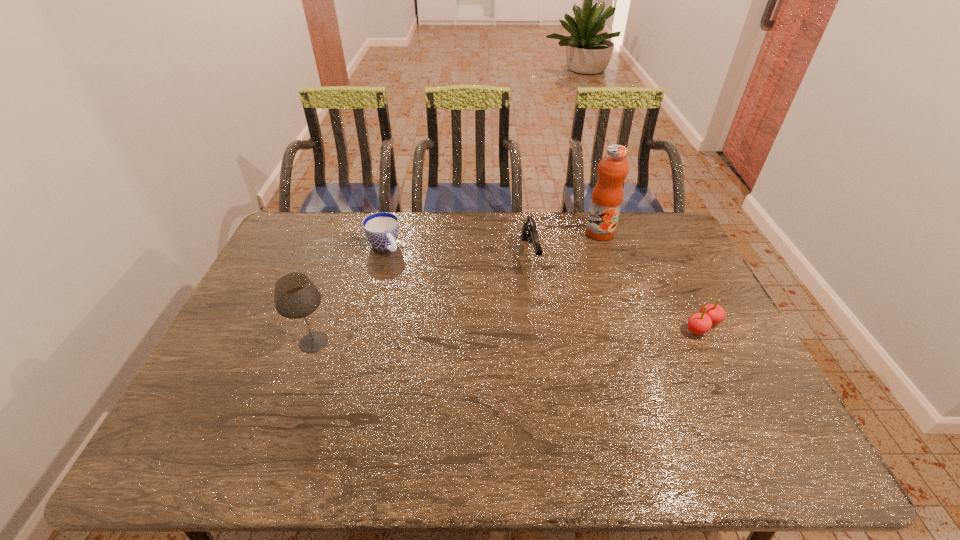
This screenshot has width=960, height=540. What are the coordinates of `cup that is at the far edge` in the screenshot? It's located at (381, 229).

Find the location of a particular element. This screenshot has width=960, height=540. fruit juice at the far edge is located at coordinates (607, 196).

The width and height of the screenshot is (960, 540). I want to click on object that is at the right edge, so click(x=699, y=323).

Image resolution: width=960 pixels, height=540 pixels. Find the location of `free space at the far edge of the desktop`. free space at the far edge of the desktop is located at coordinates (479, 234).

In the image, there is a desktop. Where is `blank space at the near edge`? blank space at the near edge is located at coordinates (678, 422).

Find the location of a particular element. The image size is (960, 540). vacant space at the left edge of the desktop is located at coordinates (220, 363).

This screenshot has height=540, width=960. In the image, there is a desktop. Identify the location of vacant space at the right edge. (678, 266).

In the image, there is a desktop. Find the location of `vacant space at the far left corner`. vacant space at the far left corner is located at coordinates (330, 212).

Where is `vacant region at the far right corner of the desktop`? The height and width of the screenshot is (540, 960). vacant region at the far right corner of the desktop is located at coordinates (643, 230).

Identify the location of vacant point located between the tallest object and the cherry. (651, 280).